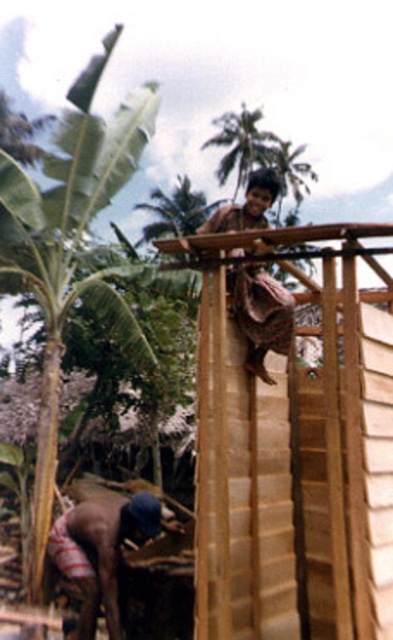
You are standing at the base of the tall wooden structure in the rural scene. You need to place a tool that is 2 meters long between the brown striped shorts at lower left and the brown woven cloth at upper center. Will the tool fit between them without bending?

The distance between the brown striped shorts at lower left and the brown woven cloth at upper center is 2.12 meters. Since the tool is 2 meters long, it will fit between them without bending as the space is slightly longer than the tool.

You are a photographer trying to capture the entire scene in one shot. Given the positions of the brown striped shorts at lower left and the brown woven cloth at upper center, which object will appear smaller in the final photo?

The brown striped shorts at lower left will appear smaller in the final photo because it occupies less space than the brown woven cloth at upper center.

You are standing in the rural tropical area depicted in the image. You see two points marked as point 1 at coordinates point (126, 513) and point 2 at coordinates point (268, 324). Which point is closer to you?

Point 1 at coordinates point (126, 513) is closer to you because it is further to the viewer than point 2 at coordinates point (268, 324).